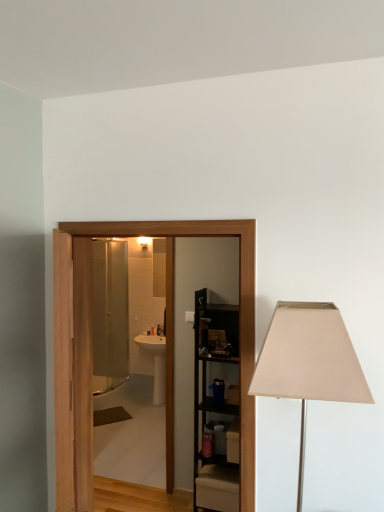
Question: Based on their sizes in the image, would you say wooden door at center is bigger or smaller than black metal shelving unit at center?

Choices:
 (A) big
 (B) small

Answer: (A)

Question: Is point (54, 309) positioned closer to the camera than point (215, 340)?

Choices:
 (A) closer
 (B) farther

Answer: (A)

Question: Which of these objects is positioned closest to the beige fabric lampshade at right?

Choices:
 (A) black metal shelving unit at center
 (B) wooden door at center
 (C) white glossy sink at center

Answer: (B)

Question: Considering the real-world distances, which object is closest to the wooden door at center?

Choices:
 (A) beige fabric lampshade at right
 (B) white glossy sink at center
 (C) black metal shelving unit at center

Answer: (A)